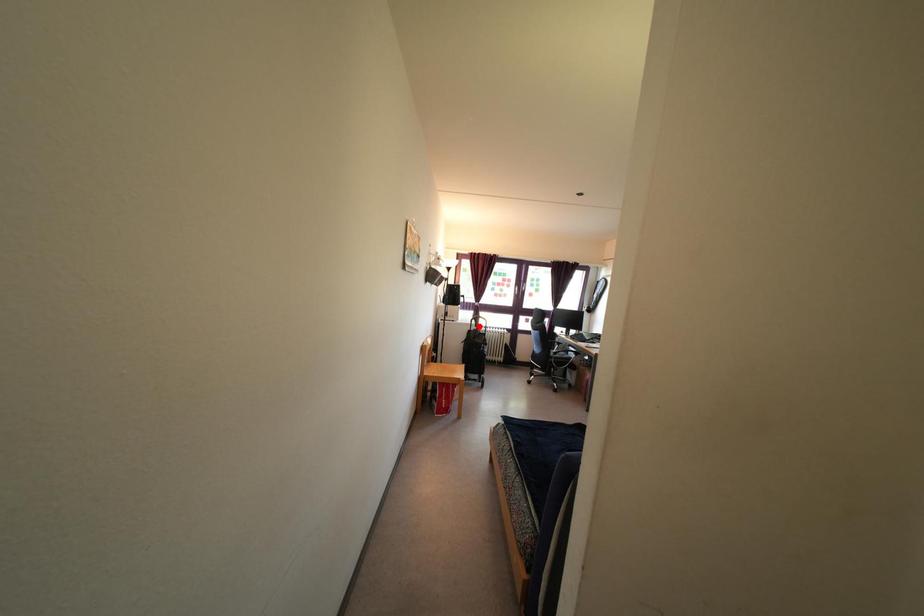
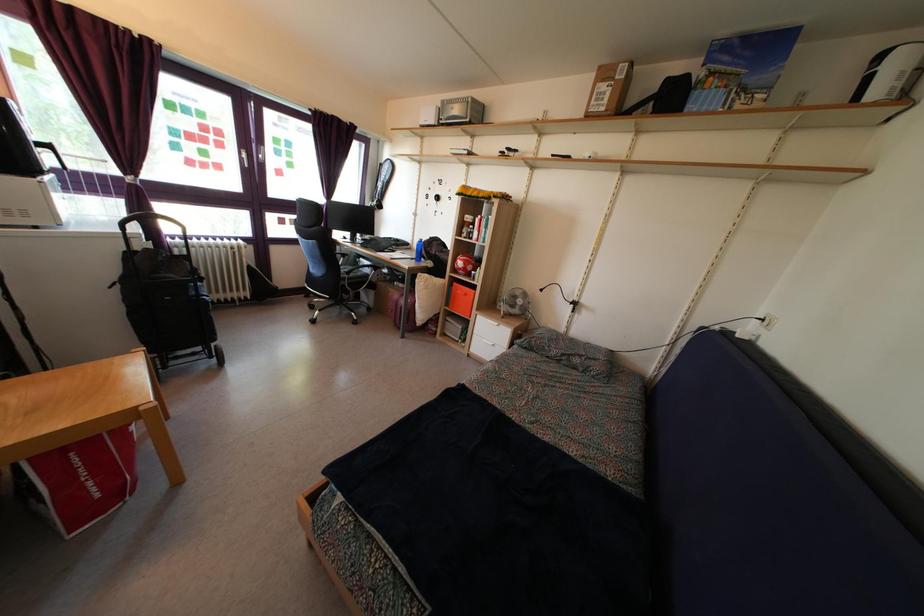
Where in the second image is the point corresponding to the highlighted location from the first image?

(146, 225)